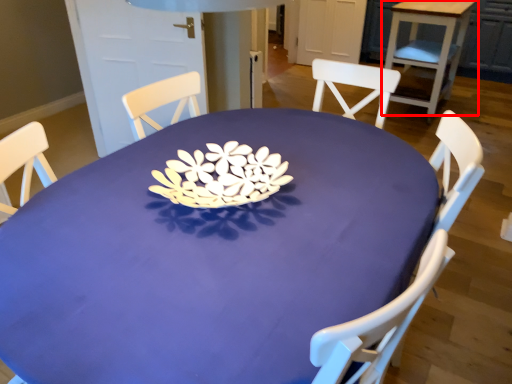
Question: Where is table (annotated by the red box) located in relation to table in the image?

Choices:
 (A) left
 (B) right

Answer: (B)